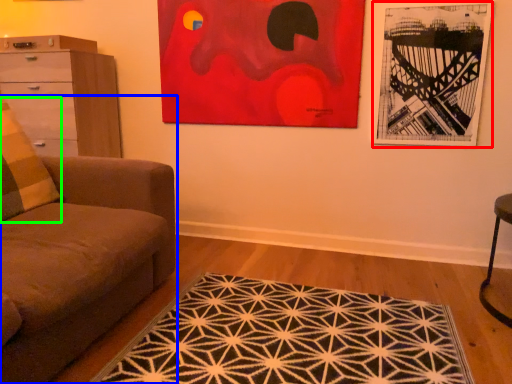
Question: Which is nearer to the picture frame (highlighted by a red box)? studio couch (highlighted by a blue box) or pillow (highlighted by a green box).

Choices:
 (A) studio couch
 (B) pillow

Answer: (A)